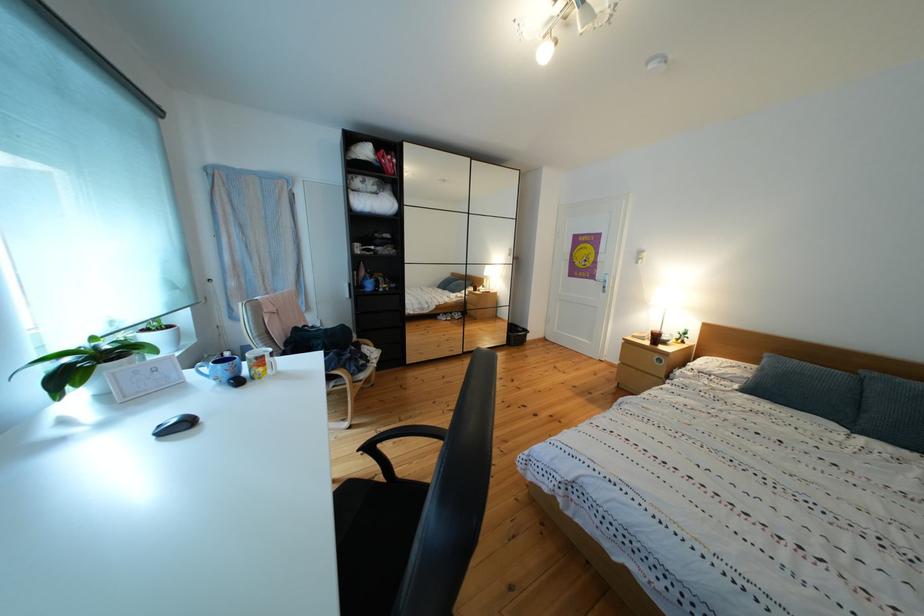
This screenshot has width=924, height=616. I want to click on drawer cutout handle, so click(x=664, y=298).